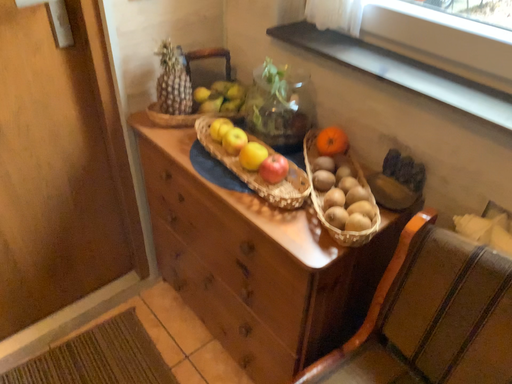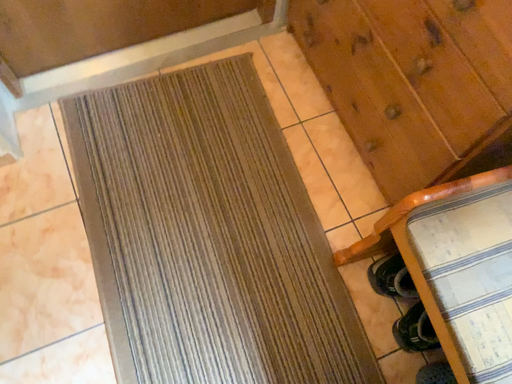
Question: How did the camera likely rotate when shooting the video?

Choices:
 (A) rotated downward
 (B) rotated upward

Answer: (A)